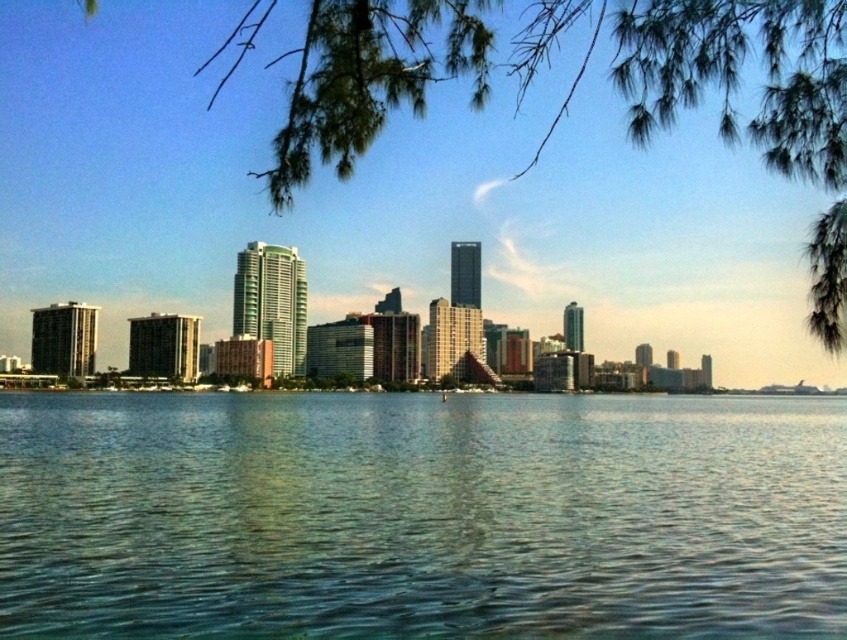
You are standing at the edge of the waterfront and see the point labeled as point (419, 516). Based on the scene, can you determine what surface this point is located on?

The point (419, 516) is located on clear blue water at center.

What are the coordinates of the clear blue water at center in the image?

The clear blue water at center is located at coordinates point (x=419, y=516).